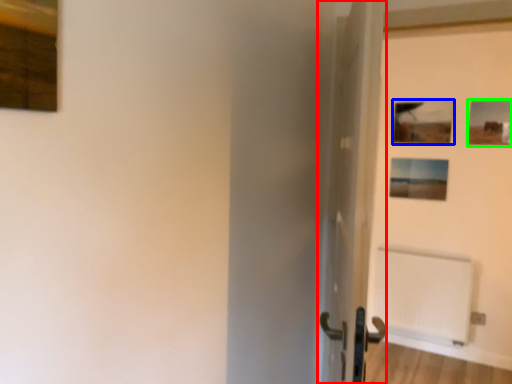
Question: Based on their relative distances, which object is nearer to door (highlighted by a red box)? Choose from picture frame (highlighted by a blue box) and picture frame (highlighted by a green box).

Choices:
 (A) picture frame
 (B) picture frame

Answer: (A)